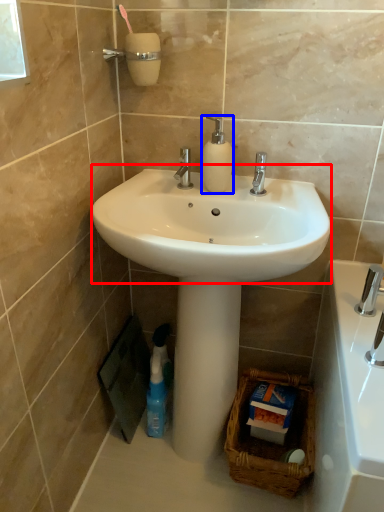
Question: Which object is closer to the camera taking this photo, sink (highlighted by a red box) or soap dispenser (highlighted by a blue box)?

Choices:
 (A) sink
 (B) soap dispenser

Answer: (A)